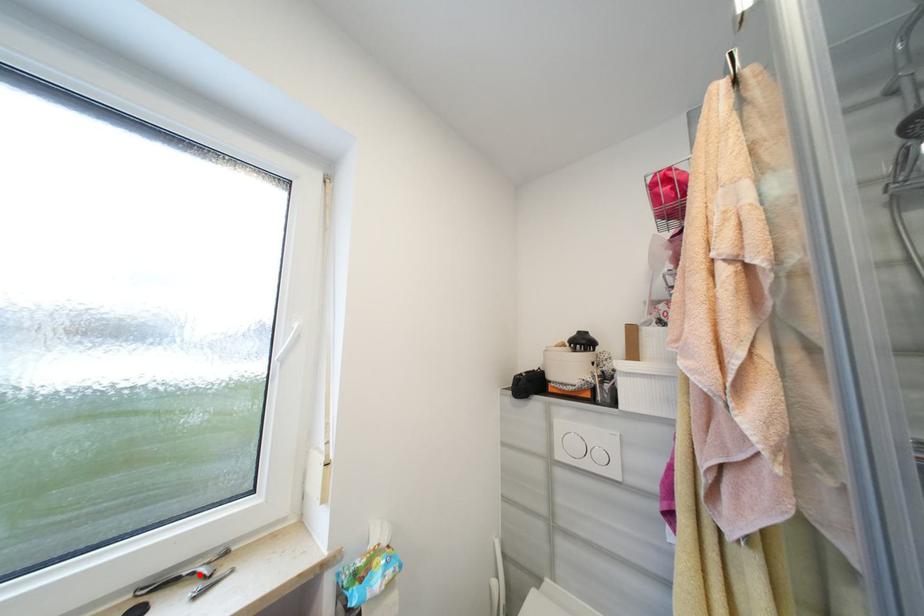
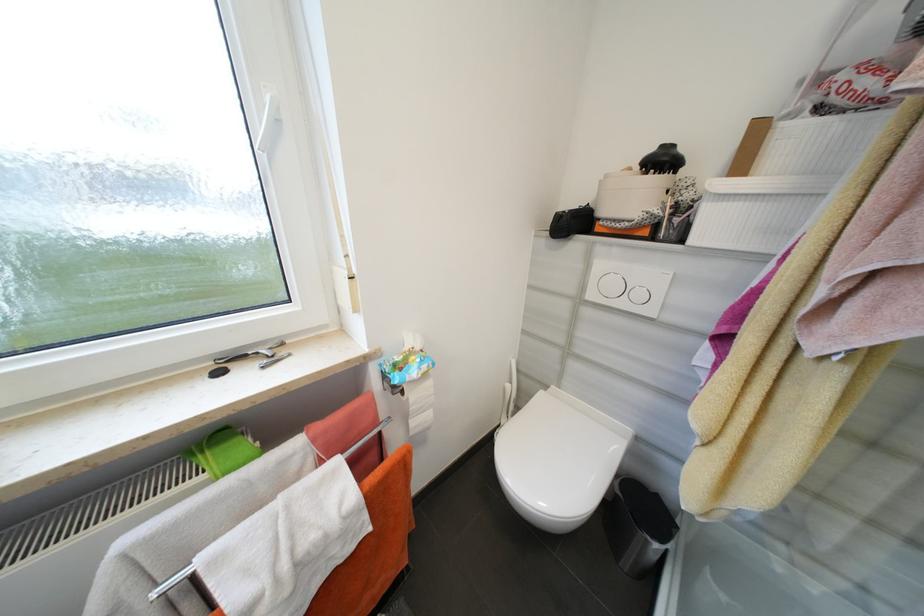
Locate, in the second image, the point that corresponds to the highlighted location in the first image.

(262, 354)